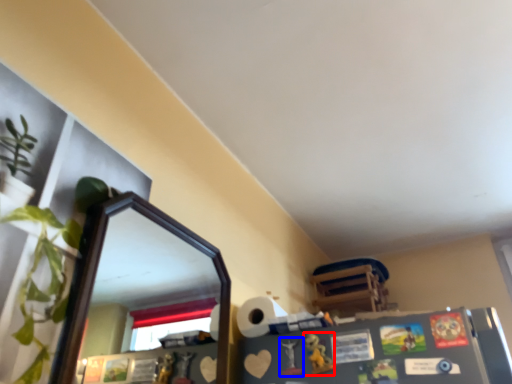
Question: Among these objects, which one is nearest to the camera, toy (highlighted by a red box) or toy (highlighted by a blue box)?

Choices:
 (A) toy
 (B) toy

Answer: (A)